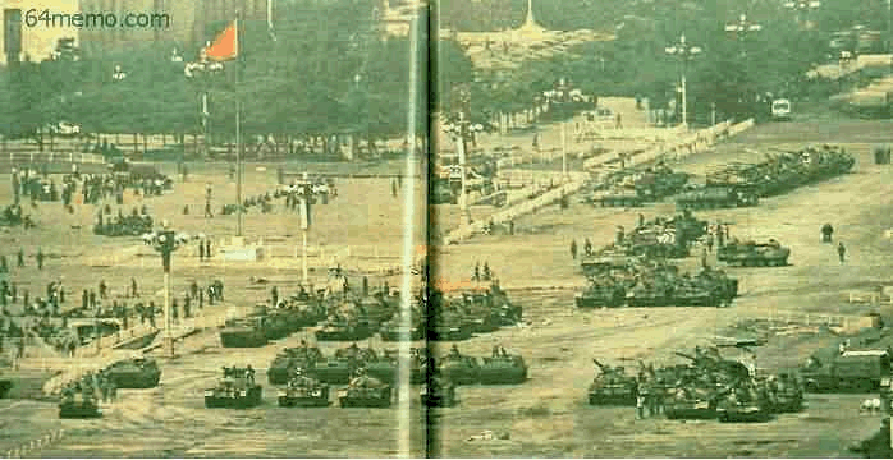
I want to click on book crease, so click(x=429, y=150).